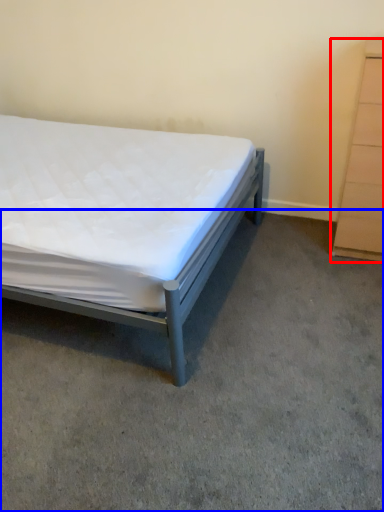
Question: Which object appears farthest to the camera in this image, chest of drawers (highlighted by a red box) or concrete (highlighted by a blue box)?

Choices:
 (A) chest of drawers
 (B) concrete

Answer: (A)